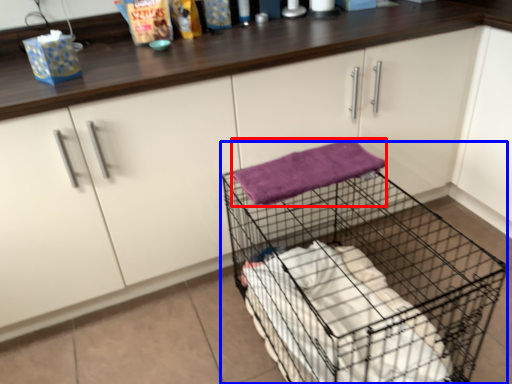
Question: Which object is further to the camera taking this photo, bath towel (highlighted by a red box) or trolley (highlighted by a blue box)?

Choices:
 (A) bath towel
 (B) trolley

Answer: (A)